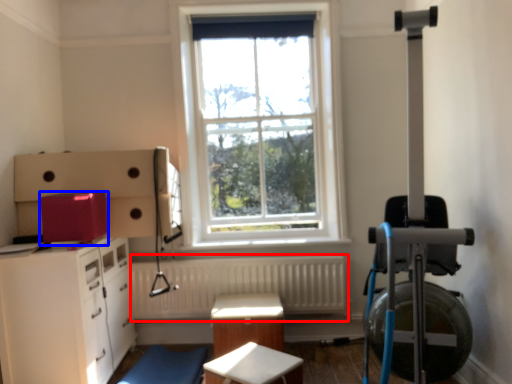
Question: Which of the following is the closest to the observer, radiator (highlighted by a red box) or appliance (highlighted by a blue box)?

Choices:
 (A) radiator
 (B) appliance

Answer: (B)